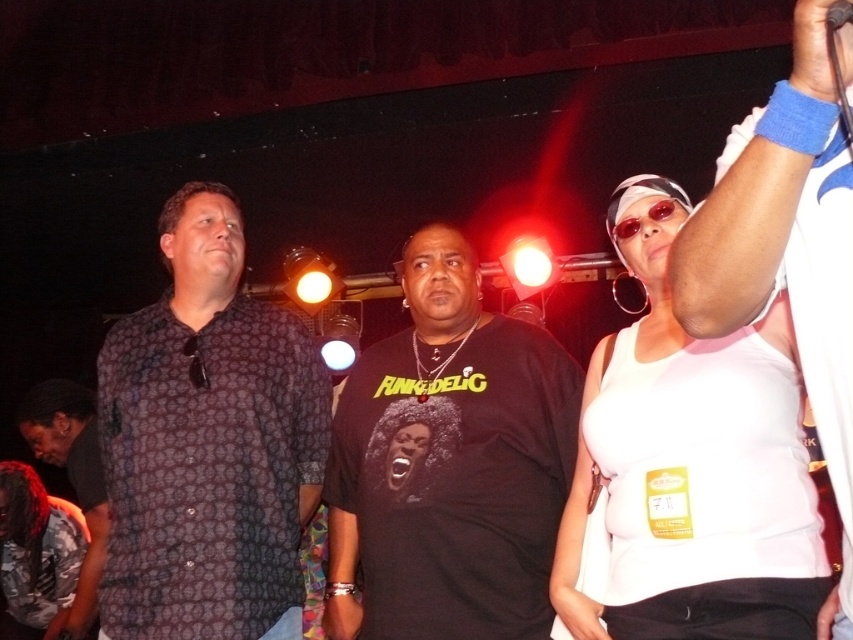
You are a photographer setting up a camera to capture the entire scene. The camera has a limited field of view. You notice the patterned fabric shirt at left and the black rubber microphone at upper right. Which object should you adjust your camera to focus on first to ensure both are in frame?

Since the patterned fabric shirt at left might be wider than the black rubber microphone at upper right, you should focus on the patterned fabric shirt at left first to ensure the wider object is centered within the camera frame before adjusting for the microphone.